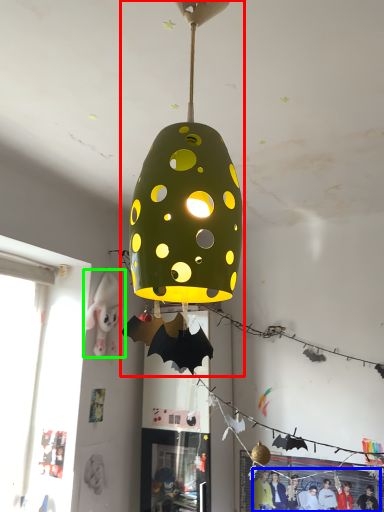
Question: Which object is positioned closest to lamp (highlighted by a red box)? Select from person (highlighted by a blue box) and person (highlighted by a green box).

Choices:
 (A) person
 (B) person

Answer: (B)